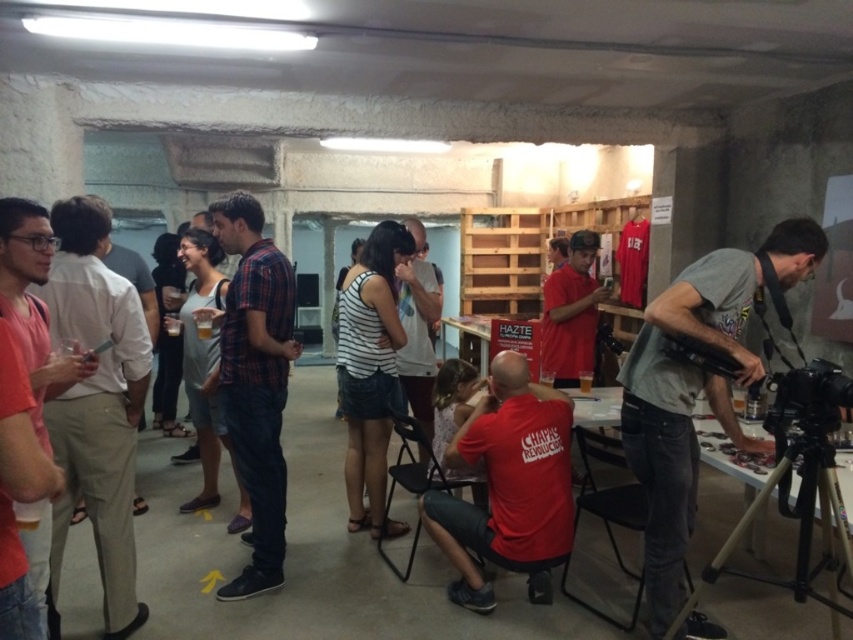
Question: Estimate the real-world distances between objects in this image. Which object is closer to the plaid shirt at center?

Choices:
 (A) red matte shirt at center
 (B) white cotton shirt at center
 (C) matte black shirt at left

Answer: (C)

Question: Among these objects, which one is farthest from the camera?

Choices:
 (A) plaid shirt at center
 (B) white cotton shirt at center
 (C) gray cotton shirt at right
 (D) matte orange t-shirt at left

Answer: (B)

Question: Does matte black shirt at left appear on the left side of matte red shirt at center?

Choices:
 (A) yes
 (B) no

Answer: (A)

Question: Can you confirm if red matte shirt at center is positioned below plaid shirt at center?

Choices:
 (A) yes
 (B) no

Answer: (A)

Question: Is gray cotton shirt at right below matte orange t-shirt at left?

Choices:
 (A) yes
 (B) no

Answer: (A)

Question: Based on their relative distances, which object is nearer to the white cotton shirt at center?

Choices:
 (A) matte black shirt at left
 (B) matte orange t-shirt at left
 (C) plaid shirt at center

Answer: (C)